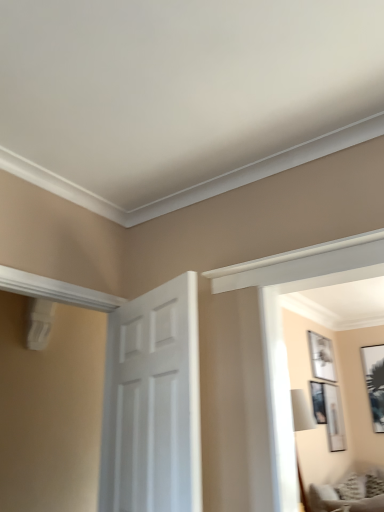
Question: From a real-world perspective, is matte black picture frame at upper right, positioned as the 2th picture frame in right-to-left order, located beneath black glossy picture frame at upper right, the 4th picture frame when ordered from left to right?

Choices:
 (A) no
 (B) yes

Answer: (B)

Question: Considering the relative sizes of matte black picture frame at upper right, positioned as the 2th picture frame in right-to-left order, and black glossy picture frame at upper right, which appears as the 1th picture frame when viewed from the right, in the image provided, is matte black picture frame at upper right, positioned as the 2th picture frame in right-to-left order, smaller than black glossy picture frame at upper right, which appears as the 1th picture frame when viewed from the right,?

Choices:
 (A) no
 (B) yes

Answer: (B)

Question: Does matte black picture frame at upper right, positioned as the 2th picture frame in right-to-left order, have a greater width compared to black glossy picture frame at upper right, which appears as the 1th picture frame when viewed from the right?

Choices:
 (A) no
 (B) yes

Answer: (A)

Question: Is matte black picture frame at upper right, positioned as the 2th picture frame in right-to-left order, shorter than black glossy picture frame at upper right, the 4th picture frame when ordered from left to right?

Choices:
 (A) no
 (B) yes

Answer: (B)

Question: Is black glossy picture frame at upper right, which appears as the 1th picture frame when viewed from the right, located within matte black picture frame at upper right, positioned as the 2th picture frame in right-to-left order?

Choices:
 (A) yes
 (B) no

Answer: (B)

Question: Do you think black glossy picture frame at upper right, the 4th picture frame when ordered from left to right, is within matte black picture frame at upper right, the 3th picture frame viewed from the left, or outside of it?

Choices:
 (A) inside
 (B) outside

Answer: (B)

Question: From a real-world perspective, relative to matte black picture frame at upper right, positioned as the 2th picture frame in right-to-left order, is black glossy picture frame at upper right, the 4th picture frame when ordered from left to right, vertically above or below?

Choices:
 (A) below
 (B) above

Answer: (B)

Question: From the image's perspective, is black glossy picture frame at upper right, the 4th picture frame when ordered from left to right, located above or below matte black picture frame at upper right, the 3th picture frame viewed from the left?

Choices:
 (A) above
 (B) below

Answer: (A)

Question: Is black glossy picture frame at upper right, which appears as the 1th picture frame when viewed from the right, in front of or behind matte black picture frame at upper right, the 3th picture frame viewed from the left, in the image?

Choices:
 (A) front
 (B) behind

Answer: (B)

Question: Looking at their shapes, would you say matte black picture frame at upper right, acting as the 1th picture frame starting from the left, is wider or thinner than white matte door at center?

Choices:
 (A) thin
 (B) wide

Answer: (A)

Question: From the image's perspective, is matte black picture frame at upper right, which is counted as the fourth picture frame, starting from the right, above or below white matte door at center?

Choices:
 (A) below
 (B) above

Answer: (A)

Question: In terms of height, does matte black picture frame at upper right, which is counted as the fourth picture frame, starting from the right, look taller or shorter compared to white matte door at center?

Choices:
 (A) tall
 (B) short

Answer: (B)

Question: Do you think matte black picture frame at upper right, acting as the 1th picture frame starting from the left, is within white matte door at center, or outside of it?

Choices:
 (A) inside
 (B) outside

Answer: (B)

Question: Does point (334, 375) appear closer or farther from the camera than point (327, 489)?

Choices:
 (A) closer
 (B) farther

Answer: (B)

Question: Is white matte picture frame at upper right, placed as the second picture frame when sorted from left to right, bigger or smaller than textured gray sofa at lower right?

Choices:
 (A) big
 (B) small

Answer: (B)